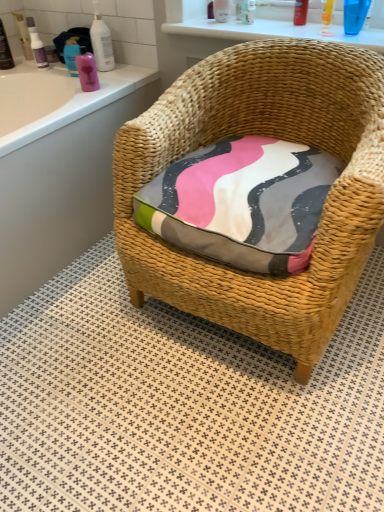
The height and width of the screenshot is (512, 384). Identify the location of vacant area to the right of translucent plastic bottle at upper center, the 3th toiletry viewed from the right. (281, 24).